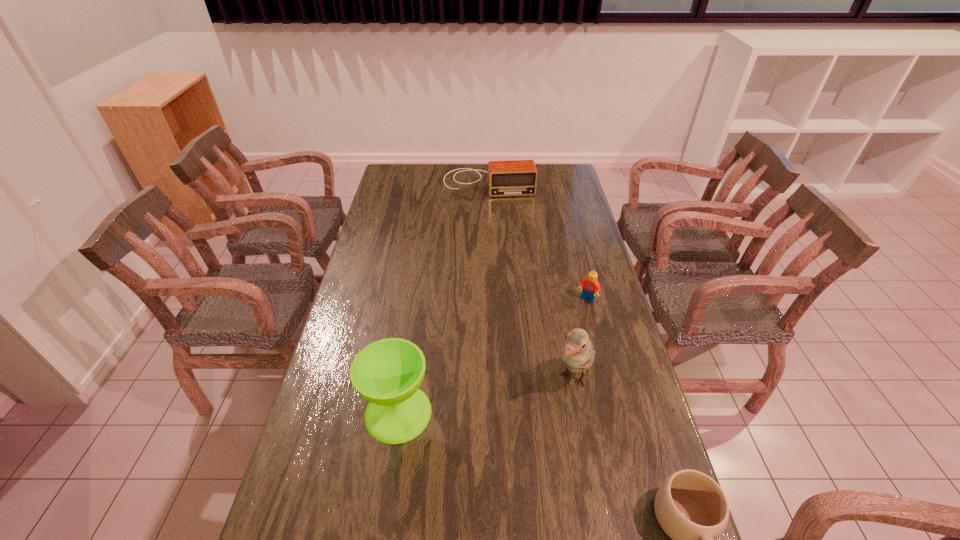
In order to click on free space on the desktop that is between the wineglass and the mug and is positioned at the face of the bird in this screenshot , I will do `click(521, 462)`.

Find the location of a particular element. vacant space on the desktop that is between the wineglass and the nearest object and is positioned on the face of the second farthest object is located at coordinates point(493,450).

The image size is (960, 540). I want to click on vacant spot on the desktop that is between the second tallest object and the nearest object and is positioned on the front-facing side of the farthest object, so click(x=531, y=465).